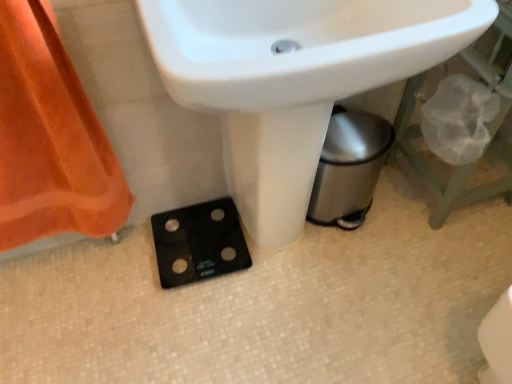
Identify the location of free space between white glossy sink at center and black glass scale at lower center. The width and height of the screenshot is (512, 384). click(x=187, y=301).